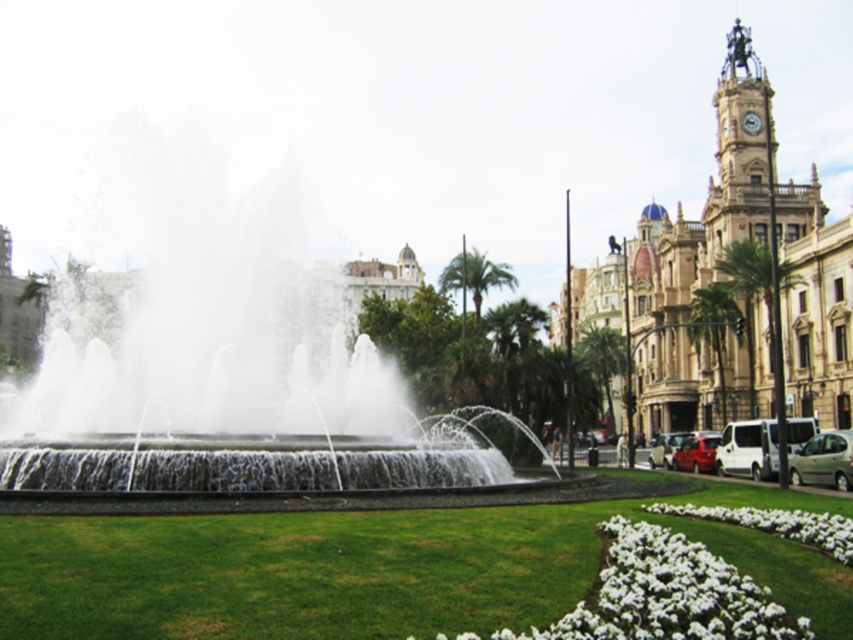
Question: Does clear water fountain at center lie behind white matte flowers at lower right?

Choices:
 (A) no
 (B) yes

Answer: (B)

Question: Is clear water fountain at center to the right of white matte flowers at lower right from the viewer's perspective?

Choices:
 (A) yes
 (B) no

Answer: (B)

Question: Is clear water fountain at center behind white matte flowers at lower right?

Choices:
 (A) yes
 (B) no

Answer: (A)

Question: Which point is farther from the camera taking this photo?

Choices:
 (A) (784, 513)
 (B) (312, 362)

Answer: (B)